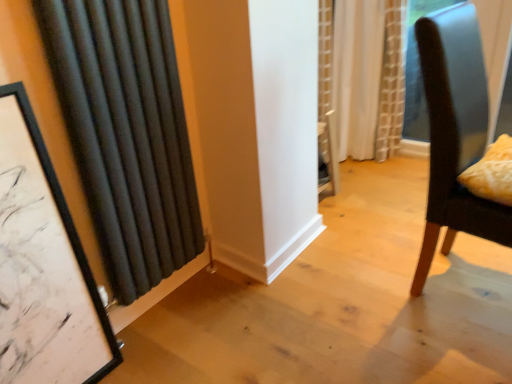
Question: Can you confirm if dark brown leather chair at right is shorter than black fabric curtain at left, which ranks as the second curtain in back-to-front order?

Choices:
 (A) yes
 (B) no

Answer: (B)

Question: Would you say dark brown leather chair at right is a long distance from black fabric curtain at left, which ranks as the first curtain in left-to-right order?

Choices:
 (A) no
 (B) yes

Answer: (A)

Question: Is dark brown leather chair at right oriented towards black fabric curtain at left, which ranks as the second curtain in back-to-front order?

Choices:
 (A) no
 (B) yes

Answer: (A)

Question: Can black fabric curtain at left, which ranks as the first curtain in left-to-right order, be found inside dark brown leather chair at right?

Choices:
 (A) yes
 (B) no

Answer: (B)

Question: Is dark brown leather chair at right outside of black fabric curtain at left, placed as the 2th curtain when sorted from right to left?

Choices:
 (A) no
 (B) yes

Answer: (B)

Question: Is dark brown leather chair at right behind black fabric curtain at left, which ranks as the first curtain in left-to-right order?

Choices:
 (A) no
 (B) yes

Answer: (A)

Question: Is yellow textured pillow at right to the left of white textured curtain at center, which is the 1th curtain in back-to-front order, from the viewer's perspective?

Choices:
 (A) yes
 (B) no

Answer: (B)

Question: Is yellow textured pillow at right placed right next to white textured curtain at center, which is the 1th curtain in back-to-front order?

Choices:
 (A) no
 (B) yes

Answer: (A)

Question: Is yellow textured pillow at right smaller than white textured curtain at center, which is the 1th curtain from right to left?

Choices:
 (A) yes
 (B) no

Answer: (A)

Question: Is yellow textured pillow at right positioned behind white textured curtain at center, positioned as the second curtain in left-to-right order?

Choices:
 (A) no
 (B) yes

Answer: (A)

Question: From the image's perspective, does yellow textured pillow at right appear lower than white textured curtain at center, which is the 1th curtain from right to left?

Choices:
 (A) no
 (B) yes

Answer: (B)

Question: Is yellow textured pillow at right positioned beyond the bounds of white textured curtain at center, which is the 1th curtain from right to left?

Choices:
 (A) yes
 (B) no

Answer: (A)

Question: From a real-world perspective, is white textured curtain at center, acting as the second curtain starting from the front, below yellow textured pillow at right?

Choices:
 (A) no
 (B) yes

Answer: (B)